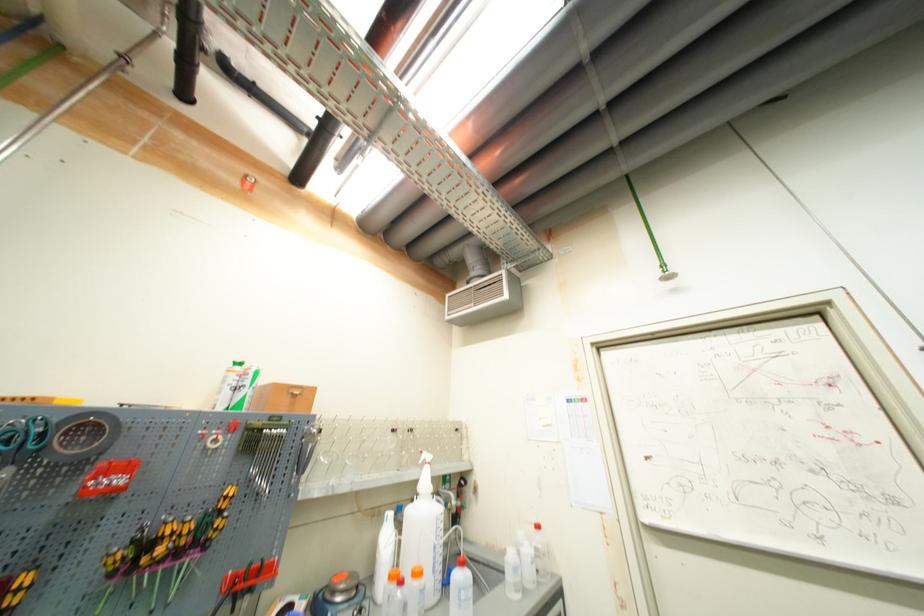
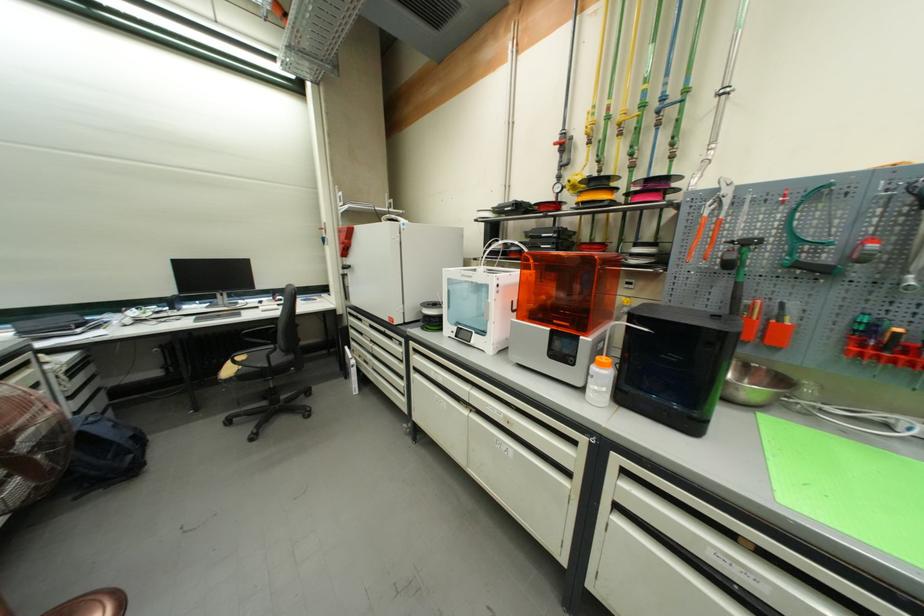
Question: The camera is either moving clockwise (left) or counter-clockwise (right) around the object. The first image is from the beginning of the video and the second image is from the end. Is the camera moving left or right when shooting the video?

Choices:
 (A) Left
 (B) Right

Answer: (B)